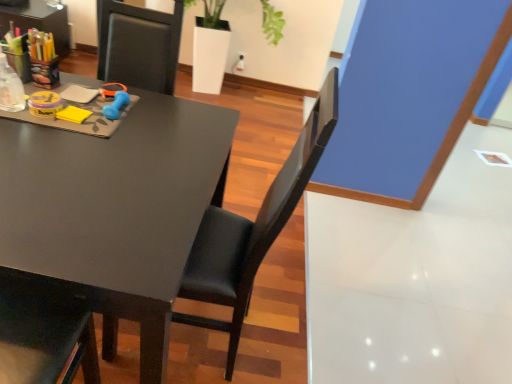
Where is `spots to the right of blue plastic scissors at upper center`? The height and width of the screenshot is (384, 512). spots to the right of blue plastic scissors at upper center is located at coordinates (151, 105).